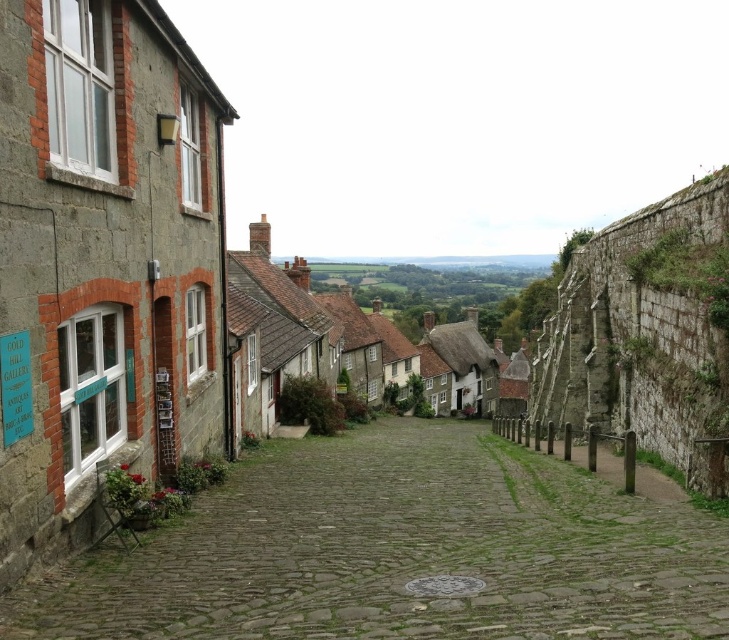
Question: Where is green cobblestone path at center located in relation to rustic stone houses at center in the image?

Choices:
 (A) left
 (B) right

Answer: (A)

Question: Is green cobblestone path at center behind rustic stone houses at center?

Choices:
 (A) no
 (B) yes

Answer: (A)

Question: Does green cobblestone path at center appear on the left side of rustic stone houses at center?

Choices:
 (A) yes
 (B) no

Answer: (A)

Question: Which point is farther from the camera taking this photo?

Choices:
 (A) (464, 339)
 (B) (585, 580)

Answer: (A)